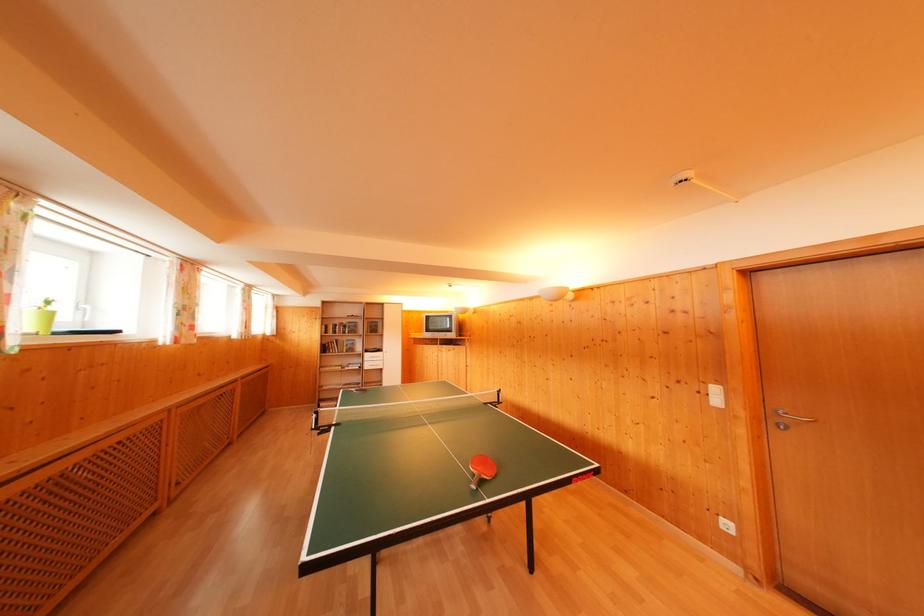
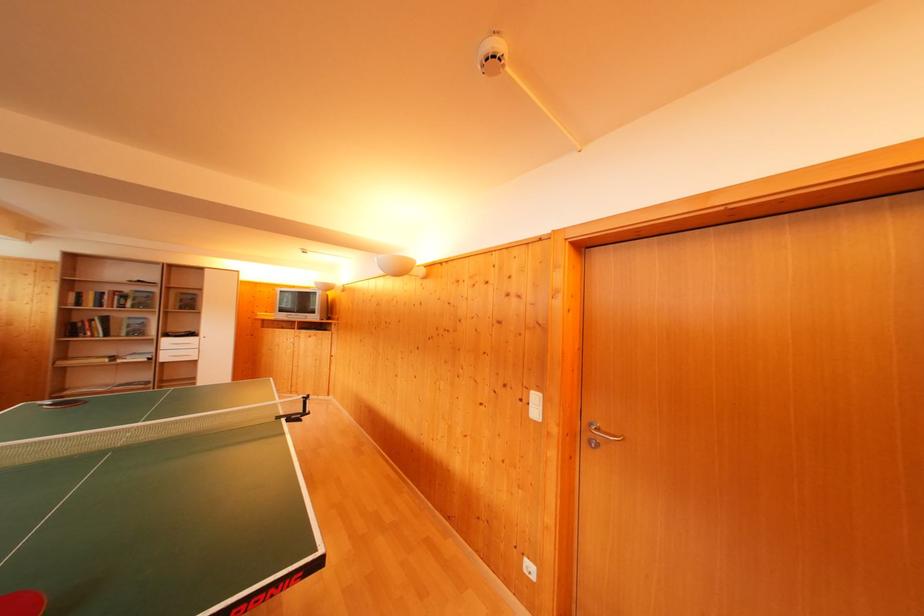
Where in the second image is the point corresponding to the point at 330,354 from the first image?

(76, 334)